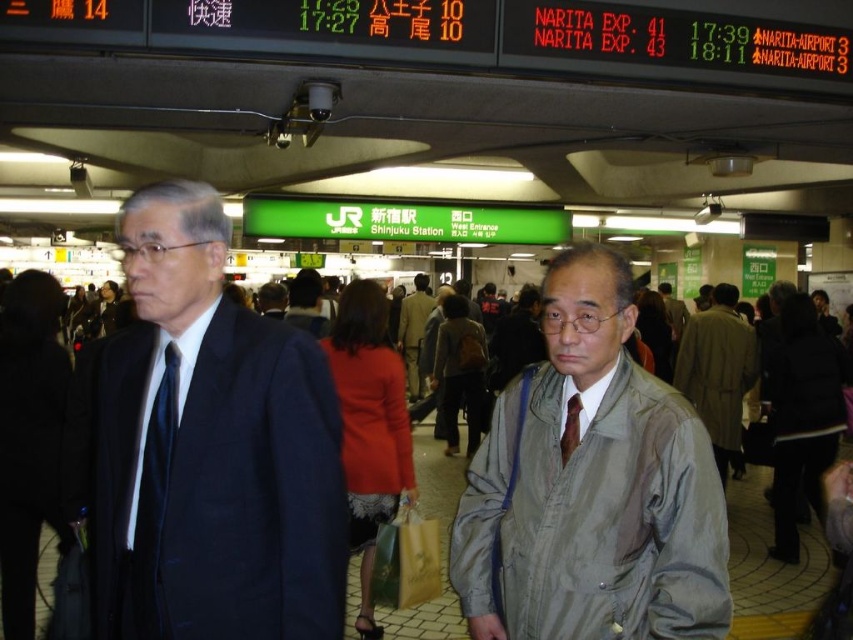
Does matte black suit at left appear over gray fabric jacket at center?

Yes, matte black suit at left is above gray fabric jacket at center.

Which is behind, point (318, 593) or point (689, 552)?

The point (318, 593) is more distant.

The image size is (853, 640). What are the coordinates of `matte black suit at left` in the screenshot? It's located at (204, 449).

Which is in front, point (287, 394) or point (567, 435)?

Point (287, 394)

Which of these two, matte black suit at left or brown silk tie at center, stands taller?

Standing taller between the two is matte black suit at left.

Who is more distant from viewer, (276, 593) or (573, 448)?

Point (573, 448)

At what (x,y) coordinates should I click in order to perform the action: click on matte black suit at left. Please return your answer as a coordinate pair (x, y). This screenshot has width=853, height=640. Looking at the image, I should click on (204, 449).

How much distance is there between gray fabric jacket at center and brown silk tie at center?

They are 9.78 inches apart.

Which is in front, point (619, 625) or point (578, 410)?

Point (619, 625)

Where is `gray fabric jacket at center`? gray fabric jacket at center is located at coordinates (590, 486).